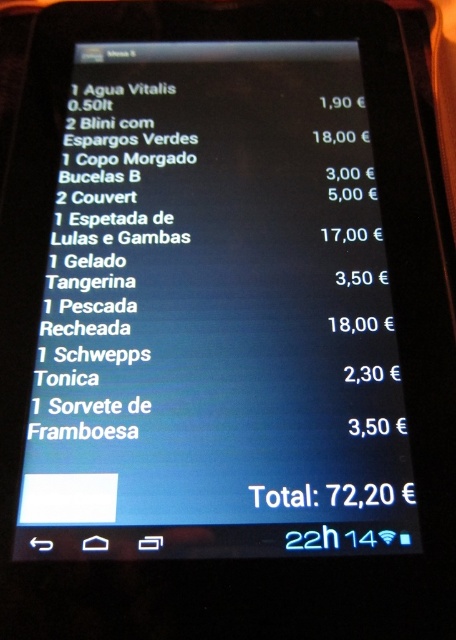
Question: Which point is closer to the camera?

Choices:
 (A) (336, 196)
 (B) (139, 113)

Answer: (A)

Question: Can you confirm if black glossy tablet at center is positioned below white paper menu at center?

Choices:
 (A) yes
 (B) no

Answer: (A)

Question: Is black glossy tablet at center above white paper menu at center?

Choices:
 (A) yes
 (B) no

Answer: (B)

Question: Where is black glossy tablet at center located in relation to white paper menu at center in the image?

Choices:
 (A) above
 (B) below

Answer: (B)